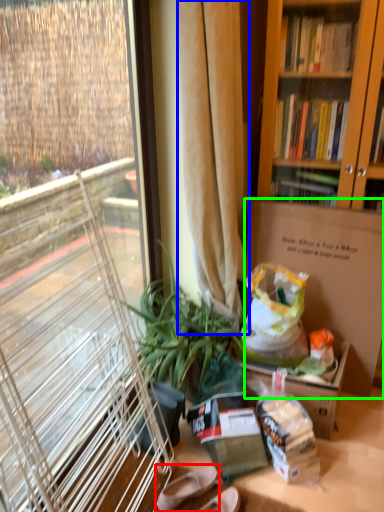
Question: Which is nearer to the footwear (highlighted by a red box)? curtain (highlighted by a blue box) or box (highlighted by a green box).

Choices:
 (A) curtain
 (B) box

Answer: (B)